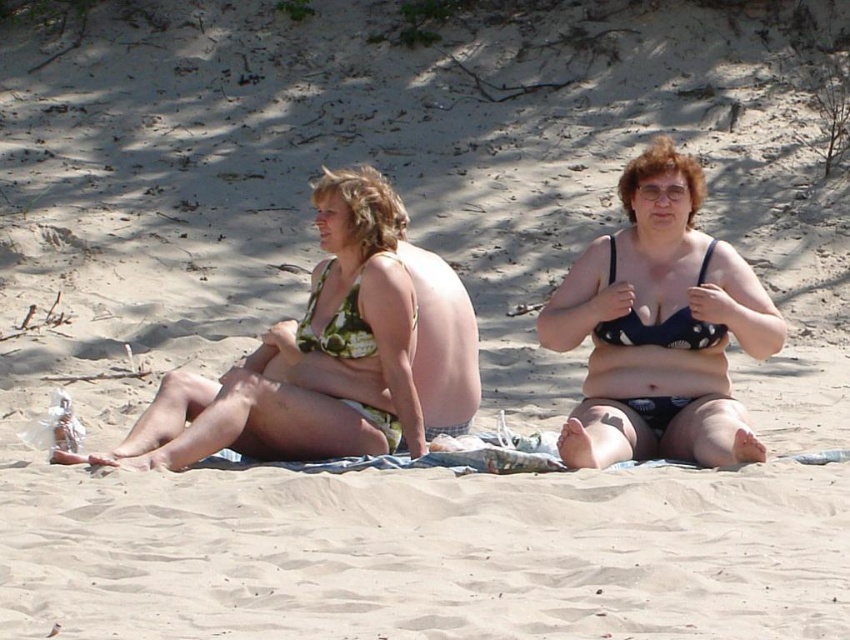
Question: Estimate the real-world distances between objects in this image. Which object is farther from the green floral bikini at left?

Choices:
 (A) matte black bikini top at center
 (B) green floral bikini top at center

Answer: (A)

Question: Is matte black bikini top at center thinner than green floral bikini at left?

Choices:
 (A) yes
 (B) no

Answer: (A)

Question: Which point is farther to the camera?

Choices:
 (A) matte black bikini top at center
 (B) green floral bikini top at center
 (C) green floral bikini at left

Answer: (B)

Question: Can you confirm if green floral bikini at left is positioned to the right of green floral bikini top at center?

Choices:
 (A) no
 (B) yes

Answer: (A)

Question: Does matte black bikini top at center have a greater width compared to green floral bikini at left?

Choices:
 (A) no
 (B) yes

Answer: (A)

Question: Among these objects, which one is farthest from the camera?

Choices:
 (A) matte black bikini top at center
 (B) green floral bikini top at center

Answer: (B)